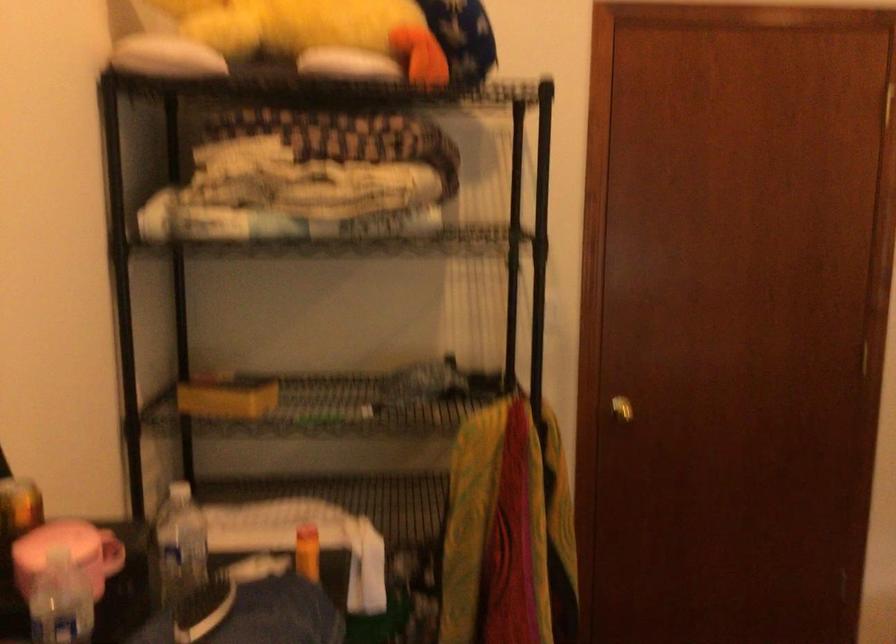
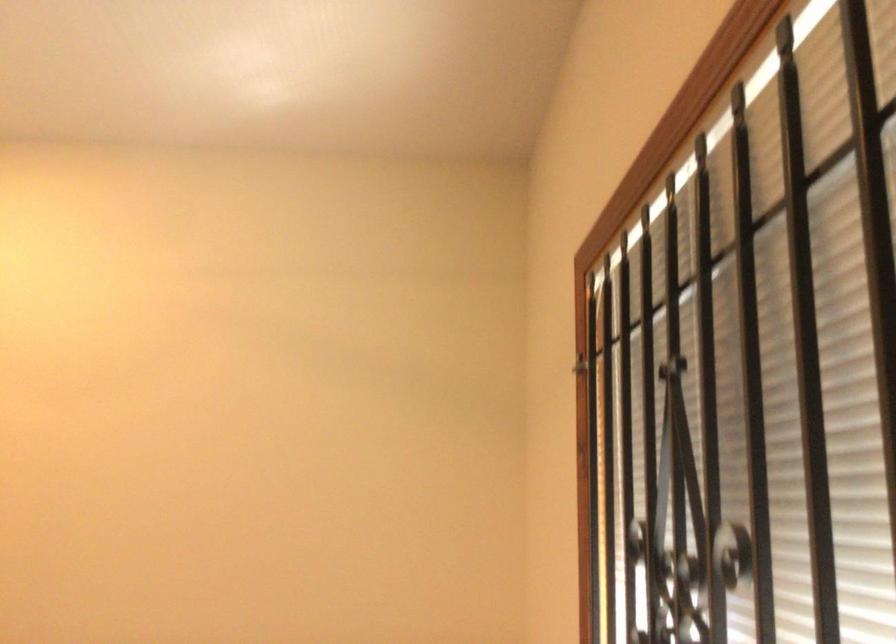
How did the camera likely rotate?

The camera's rotation is toward right-up.